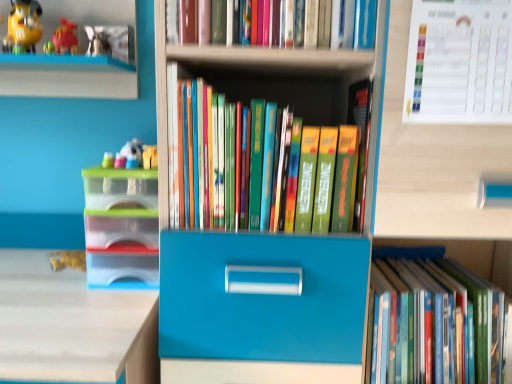
Question: Considering the positions of white paper calendar at upper right and hardcover books at center, the 2th book ordered from the bottom, in the image, is white paper calendar at upper right bigger or smaller than hardcover books at center, the 2th book ordered from the bottom,?

Choices:
 (A) small
 (B) big

Answer: (A)

Question: From the image's perspective, is white paper calendar at upper right positioned above or below hardcover books at center, which ranks as the 2th book in top-to-bottom order?

Choices:
 (A) above
 (B) below

Answer: (A)

Question: Which is nearer to the plastic toy at left, marked as the first toy in a right-to-left arrangement?

Choices:
 (A) matte yellow toy at upper left, which is counted as the 2th toy, starting from the right
 (B) white paper calendar at upper right
 (C) hardcover books at center, which ranks as the 2th book in top-to-bottom order
 (D) translucent plastic storage box at left
 (E) hardcover book at lower right, positioned as the 1th book in bottom-to-top order

Answer: (D)

Question: Considering the real-world distances, which object is farthest from the white paper calendar at upper right?

Choices:
 (A) translucent plastic storage box at left
 (B) matte yellow toy at upper left, arranged as the first toy when viewed from the top
 (C) plastic toy at left, which appears as the first toy when ordered from the bottom
 (D) hardcover books at upper center, the 1th book from the top
 (E) hardcover books at center, the 2th book ordered from the bottom

Answer: (B)